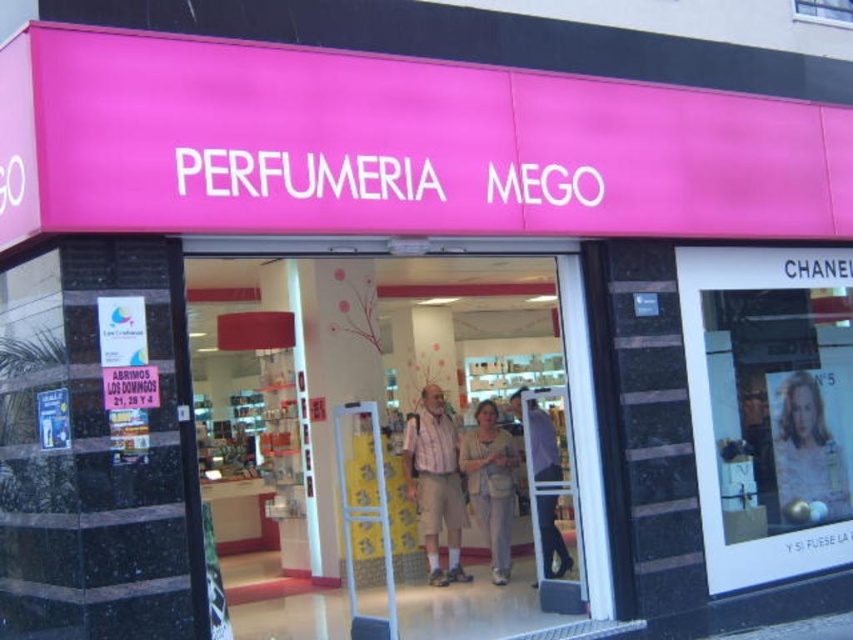
You are a delivery person trying to enter the perfume store. You notice the matte glass door at center and the plaid shirt at center. Which object is shorter in height?

The matte glass door at center is not as tall as the plaid shirt at center, so the matte glass door at center is shorter in height.

You are a customer standing in front of the perfume store Perfumeria Mego. You see a smooth plastic poster at center and a plaid shirt at center. Which object is taller?

The plaid shirt at center is taller than the smooth plastic poster at center.

You are a customer looking at the two items displayed at the center of the perfume store. Which item is positioned higher up between the plaid shirt at center and the light beige fabric dress at center?

The plaid shirt at center is located above the light beige fabric dress at center, so it is positioned higher up.